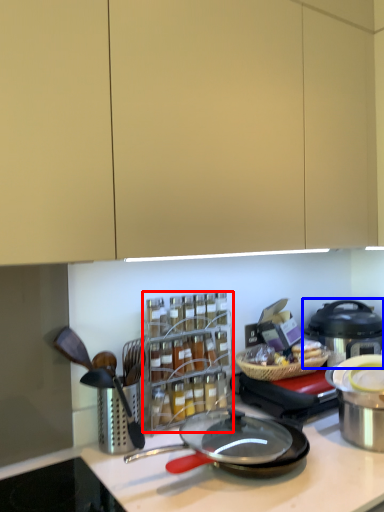
Question: Which of the following is the closest to the observer, spice rack (highlighted by a red box) or kitchen appliance (highlighted by a blue box)?

Choices:
 (A) spice rack
 (B) kitchen appliance

Answer: (A)